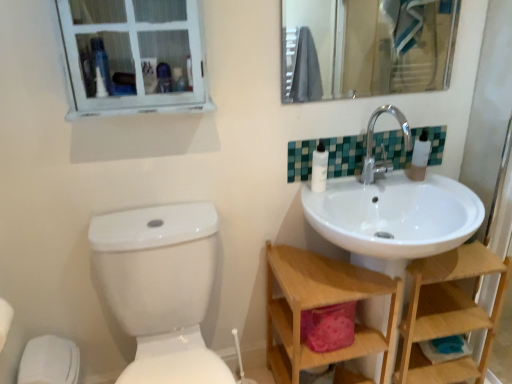
Question: Considering the positions of chrome metallic faucet at upper right and teal mosaic tiles at upper right in the image, is chrome metallic faucet at upper right taller or shorter than teal mosaic tiles at upper right?

Choices:
 (A) short
 (B) tall

Answer: (B)

Question: Is point (365, 160) closer or farther from the camera than point (334, 142)?

Choices:
 (A) farther
 (B) closer

Answer: (A)

Question: Which of these objects is positioned farthest from the teal mosaic tiles at upper right?

Choices:
 (A) chrome metallic faucet at upper right
 (B) white plastic bottles at upper right
 (C) white glossy toilet at lower left
 (D) wooden at right, the 1th shelf positioned from the right
 (E) wooden shelf at lower right, the second shelf viewed from the right

Answer: (C)

Question: Based on their relative distances, which object is nearer to the chrome metallic faucet at upper right?

Choices:
 (A) clear glass mirror at upper center
 (B) wooden shelf at lower right, placed as the 1th shelf when sorted from left to right
 (C) white wooden window at upper left
 (D) wooden at right, the 1th shelf positioned from the right
 (E) white plastic bottles at upper right

Answer: (E)